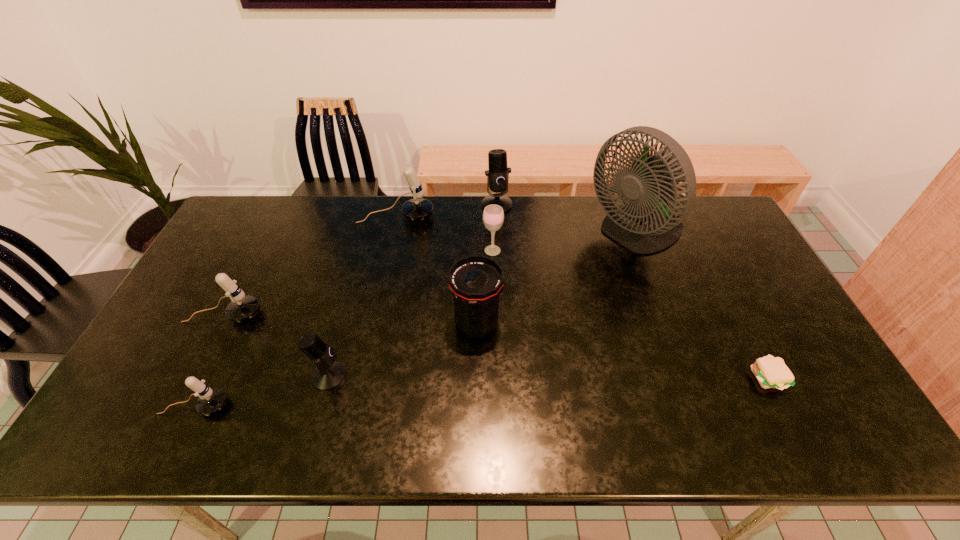
Locate an element on the screen. vacant point located between the patty and the telephoto lens is located at coordinates (622, 350).

Where is `free space that is in between the fan and the rightmost white microphone`? free space that is in between the fan and the rightmost white microphone is located at coordinates (516, 225).

At what (x,y) coordinates should I click in order to perform the action: click on free space between the second shortest object and the wineglass. Please return your answer as a coordinate pair (x, y). Looking at the image, I should click on (344, 328).

At what (x,y) coordinates should I click in order to perform the action: click on free space between the second biggest white microphone and the telephoto lens. Please return your answer as a coordinate pair (x, y). Looking at the image, I should click on (350, 319).

What are the coordinates of `free spot between the third nearest microphone and the left black microphone` in the screenshot? It's located at (276, 345).

Identify which object is located as the fourth nearest to the telephoto lens. Please provide its 2D coordinates. Your answer should be formatted as a tuple, i.e. [(x, y)], where the tuple contains the x and y coordinates of a point satisfying the conditions above.

[(416, 209)]

The image size is (960, 540). I want to click on object that stands as the seventh closest to the wineglass, so click(771, 372).

Identify which microphone is located as the fourth nearest to the telephoto lens. Please provide its 2D coordinates. Your answer should be formatted as a tuple, i.e. [(x, y)], where the tuple contains the x and y coordinates of a point satisfying the conditions above.

[(241, 308)]

Identify which microphone is located as the fourth nearest to the farther black microphone. Please provide its 2D coordinates. Your answer should be formatted as a tuple, i.e. [(x, y)], where the tuple contains the x and y coordinates of a point satisfying the conditions above.

[(210, 401)]

Point out which white microphone is positioned as the nearest to the nearest white microphone. Please provide its 2D coordinates. Your answer should be formatted as a tuple, i.e. [(x, y)], where the tuple contains the x and y coordinates of a point satisfying the conditions above.

[(241, 308)]